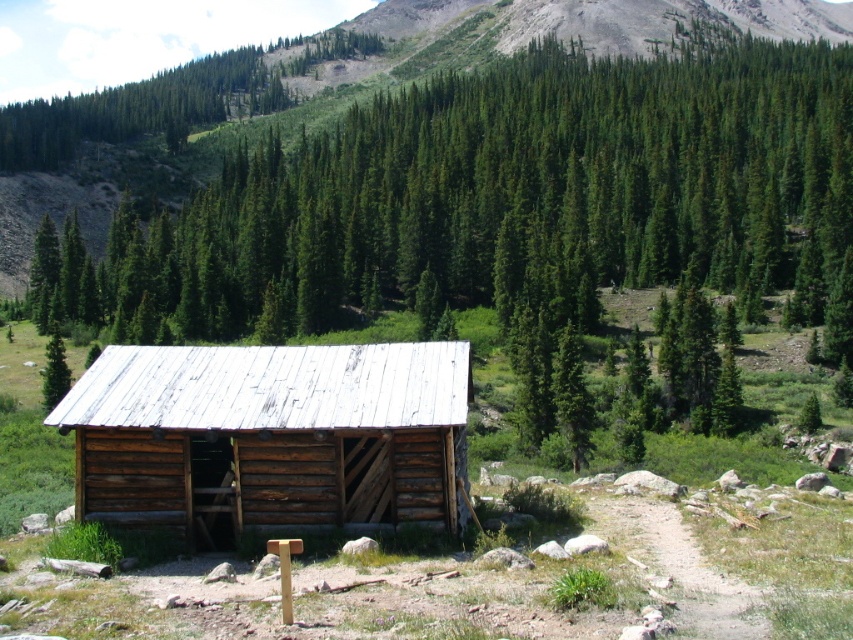
Question: Can you confirm if weathered wood shed at center is positioned below green matte tree at center?

Choices:
 (A) yes
 (B) no

Answer: (A)

Question: Where is weathered wood shed at center located in relation to green matte tree at center in the image?

Choices:
 (A) right
 (B) left

Answer: (A)

Question: Among these points, which one is nearest to the camera?

Choices:
 (A) (51, 358)
 (B) (378, 436)

Answer: (B)

Question: Among these objects, which one is farthest from the camera?

Choices:
 (A) weathered wood cabin at center
 (B) green matte tree at center
 (C) weathered wood shed at center

Answer: (B)

Question: Which point appears farthest from the camera in this image?

Choices:
 (A) (61, 381)
 (B) (440, 138)

Answer: (B)

Question: Does weathered wood cabin at center have a greater width compared to weathered wood shed at center?

Choices:
 (A) no
 (B) yes

Answer: (B)